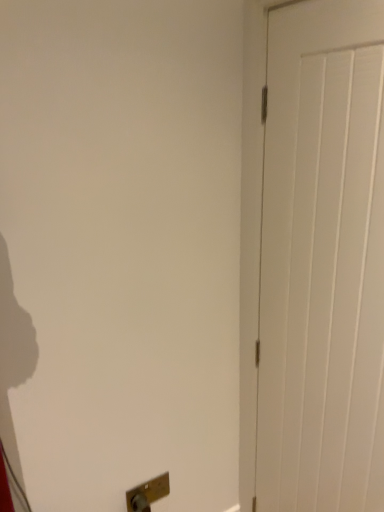
Identify the location of metallic gold electric outlet at lower center. (147, 493).

Describe the element at coordinates (147, 493) in the screenshot. The image size is (384, 512). I see `metallic gold electric outlet at lower center` at that location.

I want to click on metallic gold electric outlet at lower center, so click(147, 493).